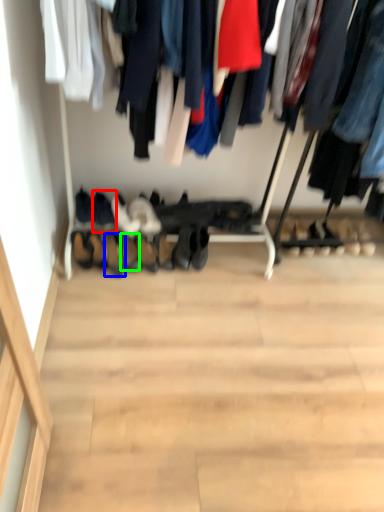
Question: Based on their relative distances, which object is farther from footwear (highlighted by a red box)? Choose from footwear (highlighted by a blue box) and shoe (highlighted by a green box).

Choices:
 (A) footwear
 (B) shoe

Answer: (B)